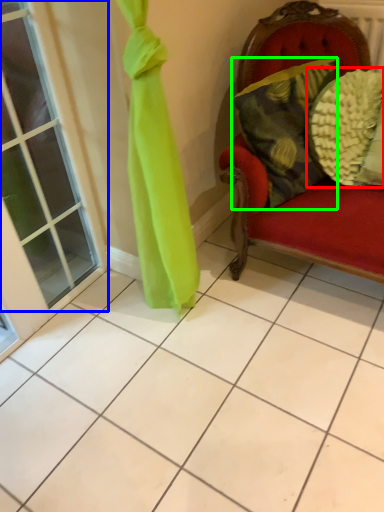
Question: Which object is positioned farthest from pillow (highlighted by a red box)? Select from window (highlighted by a blue box) and pillow (highlighted by a green box).

Choices:
 (A) window
 (B) pillow

Answer: (A)